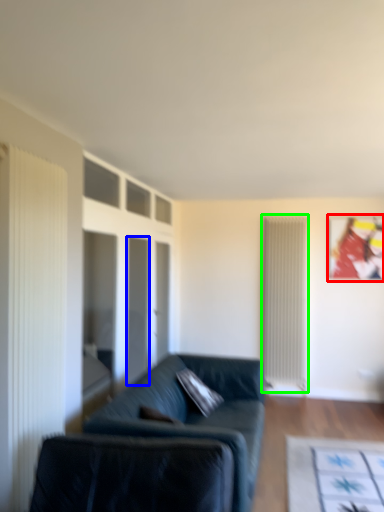
Question: Which object is positioned closest to picture frame (highlighted by a red box)? Select from glass door (highlighted by a blue box) and radiator (highlighted by a green box).

Choices:
 (A) glass door
 (B) radiator

Answer: (B)